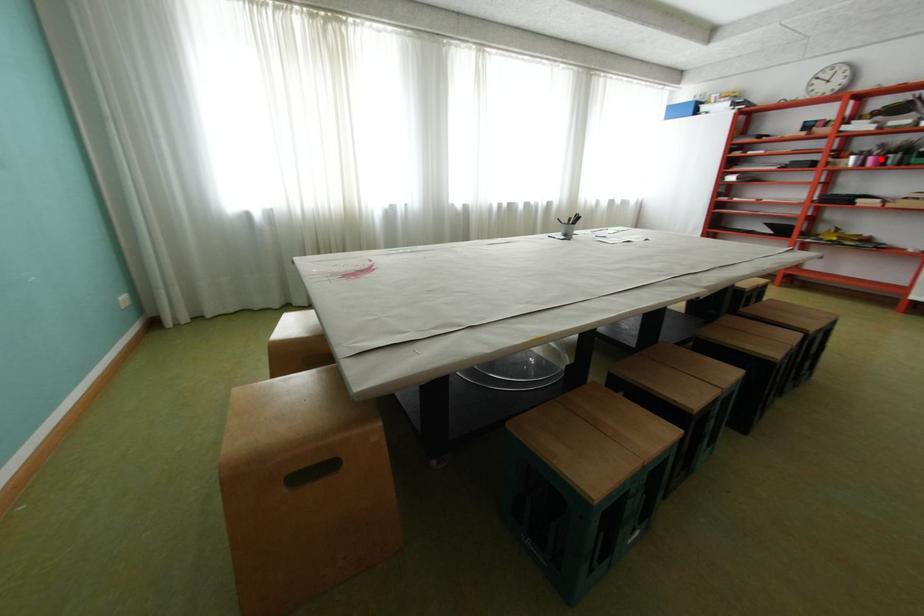
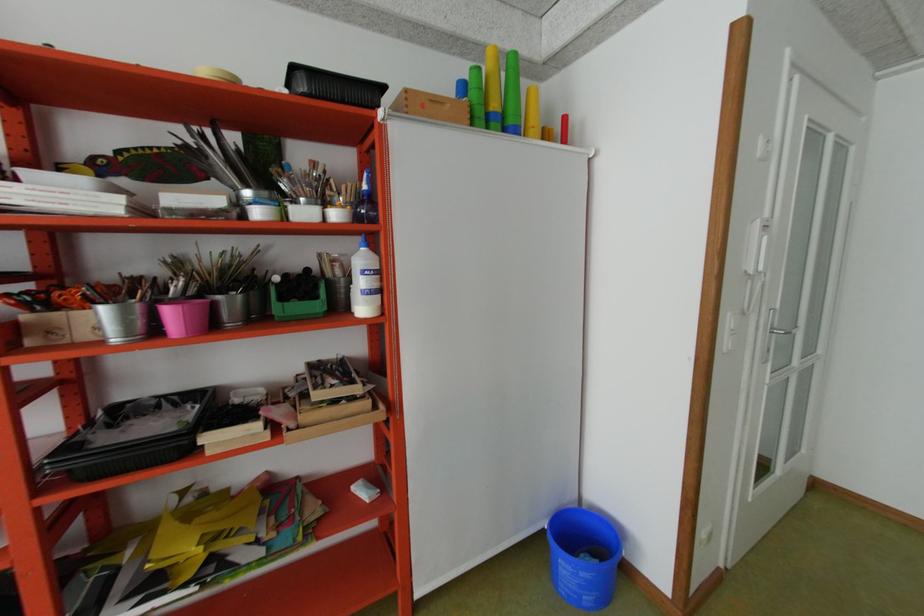
Question: I am providing you with two images of the same scene from different viewpoints. Image1 has a red point marked. In image2, the corresponding 3D location appears at what relative position? Reply with the corresponding letter.

Choices:
 (A) Closer
 (B) Farther

Answer: (A)